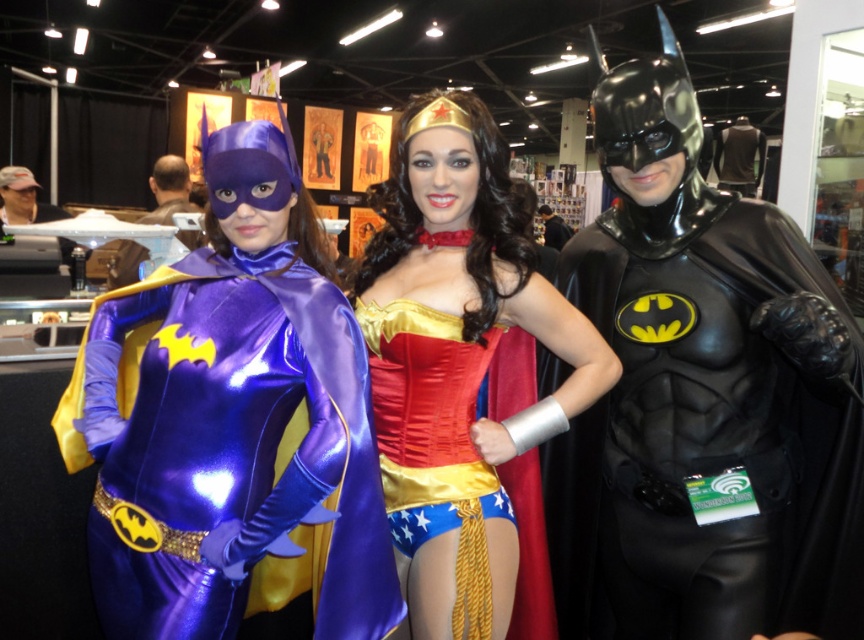
You are a photographer at the convention and need to capture a group photo of the shiny purple costume at left and the satin gold corset at center. The camera you are using has a minimum focus distance of 10 inches. Will you be able to focus on both subjects clearly without moving the camera?

The shiny purple costume at left is 11.22 inches away from the satin gold corset at center. Since the camera has a minimum focus distance of 10 inches, the distance between them is sufficient for both subjects to be in focus. Therefore, you can capture both the shiny purple costume at left and the satin gold corset at center clearly without moving the camera.

You are standing in the convention hall and see the black glossy batman costume at right and the shiny purple costume at left. Which one is positioned more to the east side of the hall?

The black glossy batman costume at right is positioned to the right of the shiny purple costume at left, so it is more to the east side of the hall.

You are organizing a group photo for the superheroes. The black glossy batman costume at right and the shiny purple costume at left need to stand side by side. Based on their widths, which superhero should stand closer to the center to ensure both fit within the frame?

The black glossy batman costume at right is narrower than the shiny purple costume at left. To ensure both fit within the frame, the wider shiny purple costume at left should be positioned closer to the center, allowing space for the narrower black glossy batman costume at right on the side.